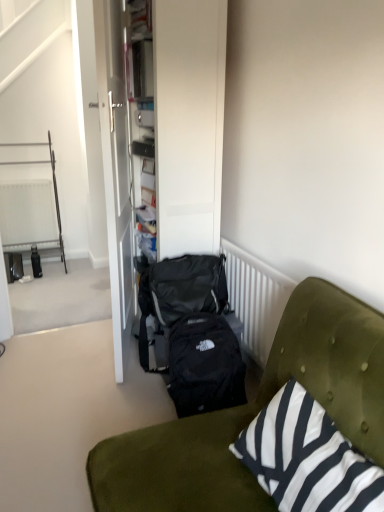
Where is `free space in front of matte black bottle at left`? The height and width of the screenshot is (512, 384). free space in front of matte black bottle at left is located at coordinates (30, 286).